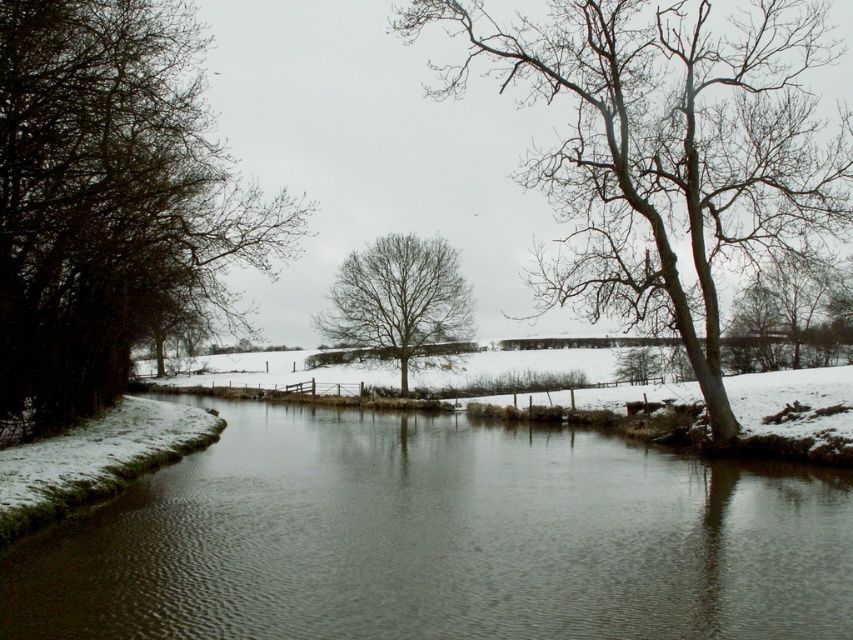
Question: Which point is farther to the camera?

Choices:
 (A) (360, 308)
 (B) (608, 147)
 (C) (824, 540)
 (D) (271, 227)

Answer: (A)

Question: Among these points, which one is nearest to the camera?

Choices:
 (A) (438, 589)
 (B) (816, 316)
 (C) (630, 168)
 (D) (83, 131)

Answer: (A)

Question: Is brown smooth water at center bigger than bare wood tree at upper right?

Choices:
 (A) yes
 (B) no

Answer: (B)

Question: Can you confirm if bare wood tree at center is thinner than bare wood tree at upper right?

Choices:
 (A) no
 (B) yes

Answer: (B)

Question: Based on their relative distances, which object is farther from the bare wood tree at center?

Choices:
 (A) dark green leafless tree at left
 (B) brown smooth water at center

Answer: (B)

Question: Is dark green leafless tree at left positioned before bare wood tree at center?

Choices:
 (A) yes
 (B) no

Answer: (A)